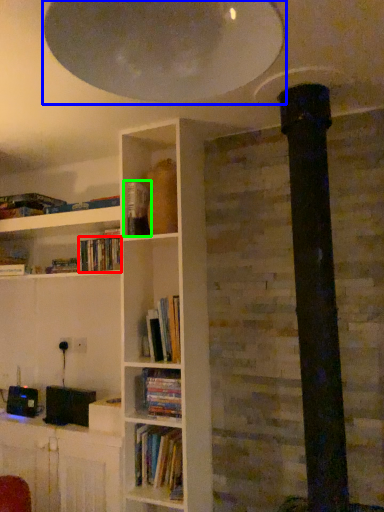
Question: Considering the real-world distances, which object is farthest from book (highlighted by a red box)? exhaust hood (highlighted by a blue box) or paperback book (highlighted by a green box)?

Choices:
 (A) exhaust hood
 (B) paperback book

Answer: (A)